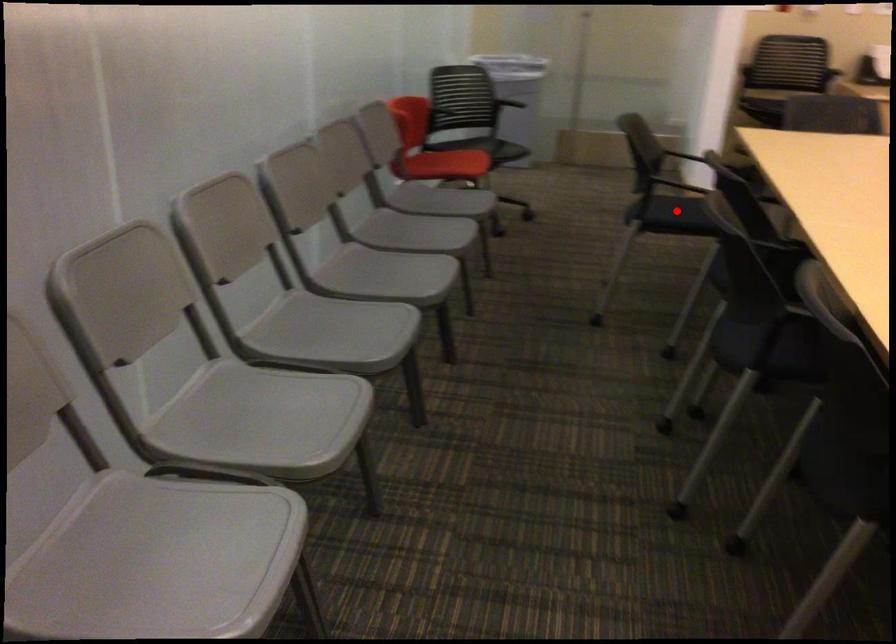
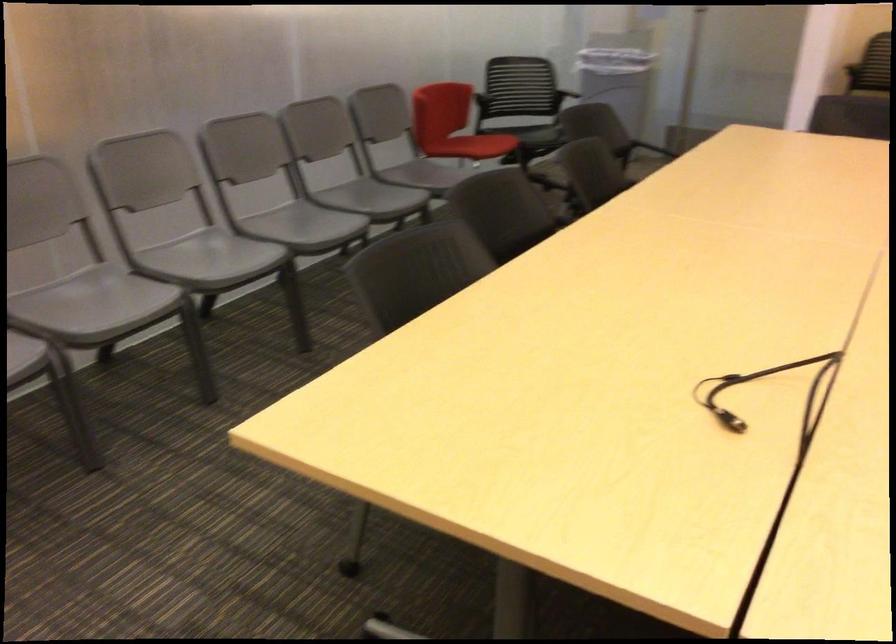
Question: I am providing you with two images of the same scene from different viewpoints. A red point is marked on the first image. Is the red point's position out of view in image 2?

Choices:
 (A) Yes
 (B) No

Answer: (A)